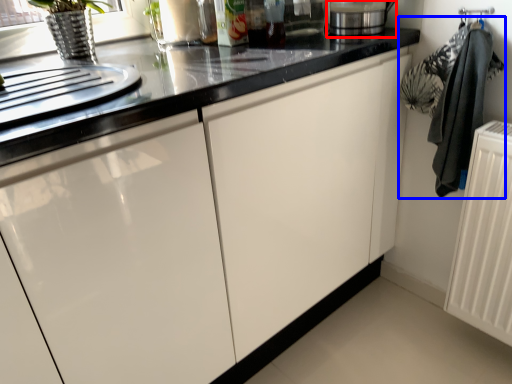
Question: Among these objects, which one is farthest to the camera, appliance (highlighted by a red box) or laundry (highlighted by a blue box)?

Choices:
 (A) appliance
 (B) laundry

Answer: (A)